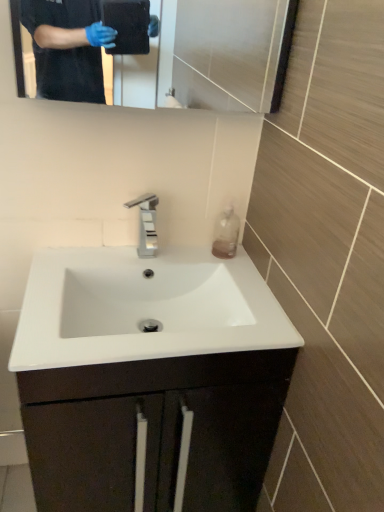
The height and width of the screenshot is (512, 384). I want to click on free area below glossy metallic mirror at upper center (from a real-world perspective), so click(139, 254).